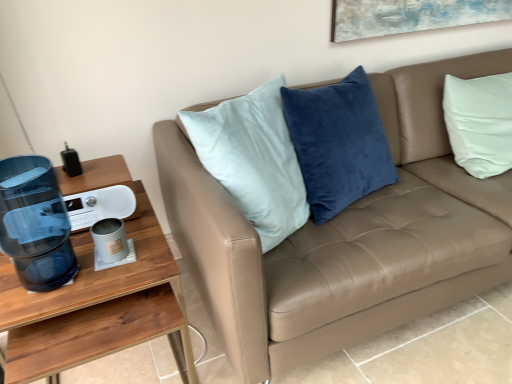
This screenshot has height=384, width=512. In order to click on wooden desk at left in this screenshot , I will do `click(97, 308)`.

Locate an element on the screen. This screenshot has width=512, height=384. matte gray mug at lower left is located at coordinates (110, 240).

Locate an element on the screen. transparent plastic water cooler at left is located at coordinates (35, 223).

Image resolution: width=512 pixels, height=384 pixels. What are the coordinates of `tan leather couch at center` in the screenshot? It's located at (346, 237).

Would you consider tan leather couch at center to be distant from transparent plastic water cooler at left?

Actually, tan leather couch at center and transparent plastic water cooler at left are a little close together.

What are the coordinates of `water cooler behind the tan leather couch at center` in the screenshot? It's located at (35, 223).

Consider the image. How much distance is there between tan leather couch at center and transparent plastic water cooler at left?

tan leather couch at center and transparent plastic water cooler at left are 71.36 centimeters apart.

Is point (470, 71) positioned before point (19, 219)?

No, it is behind (19, 219).

Would you say transparent plastic water cooler at left is inside or outside wooden desk at left?

transparent plastic water cooler at left is not enclosed by wooden desk at left.

Is transparent plastic water cooler at left turned away from wooden desk at left?

No, transparent plastic water cooler at left is not facing away from wooden desk at left.

From a real-world perspective, does transparent plastic water cooler at left sit lower than wooden desk at left?

No, from a real-world perspective, transparent plastic water cooler at left is not under wooden desk at left.

Considering the points (51, 208) and (122, 347), which point is in front, point (51, 208) or point (122, 347)?

The point (122, 347) is closer.

Where is `coffee cup behind the wooden desk at left`? coffee cup behind the wooden desk at left is located at coordinates (110, 240).

From the image's perspective, relative to matte gray mug at lower left, is wooden desk at left above or below?

From the image's perspective, wooden desk at left appears below matte gray mug at lower left.

Which is in front, point (64, 358) or point (124, 253)?

Positioned in front is point (64, 358).

Is matte gray mug at lower left completely or partially inside wooden desk at left?

No.

Is wooden desk at left not within transparent plastic water cooler at left?

Yes, wooden desk at left is outside of transparent plastic water cooler at left.

Which object is positioned more to the left, wooden desk at left or transparent plastic water cooler at left?

transparent plastic water cooler at left is more to the left.

In terms of height, does wooden desk at left look taller or shorter compared to transparent plastic water cooler at left?

wooden desk at left is taller than transparent plastic water cooler at left.

Is wooden desk at left bigger than transparent plastic water cooler at left?

Yes.

Which is in front, matte gray mug at lower left or wooden desk at left?

Positioned in front is wooden desk at left.

Would you say matte gray mug at lower left is a long distance from wooden desk at left?

No, matte gray mug at lower left is in close proximity to wooden desk at left.

Can you confirm if matte gray mug at lower left is thinner than wooden desk at left?

Yes.

From the image's perspective, is tan leather couch at center on wooden desk at left?

Yes, from the image's perspective, tan leather couch at center is on top of wooden desk at left.

Can you confirm if tan leather couch at center is smaller than wooden desk at left?

Incorrect, tan leather couch at center is not smaller in size than wooden desk at left.

Could you tell me if tan leather couch at center is facing wooden desk at left?

No, tan leather couch at center is not turned towards wooden desk at left.

From a real-world perspective, which is physically below, tan leather couch at center or wooden desk at left?

wooden desk at left, from a real-world perspective.

From a real-world perspective, between transparent plastic water cooler at left and tan leather couch at center, who is vertically higher?

In real-world perspective, transparent plastic water cooler at left is above.

Where is `studio couch in front of the transparent plastic water cooler at left`? The image size is (512, 384). studio couch in front of the transparent plastic water cooler at left is located at coordinates (346, 237).

Considering the relative sizes of transparent plastic water cooler at left and tan leather couch at center in the image provided, is transparent plastic water cooler at left thinner than tan leather couch at center?

Indeed, transparent plastic water cooler at left has a lesser width compared to tan leather couch at center.

Does transparent plastic water cooler at left appear on the right side of tan leather couch at center?

In fact, transparent plastic water cooler at left is to the left of tan leather couch at center.

At what (x,y) coordinates should I click in order to perform the action: click on studio couch above the transparent plastic water cooler at left (from the image's perspective). Please return your answer as a coordinate pair (x, y). The height and width of the screenshot is (384, 512). Looking at the image, I should click on (x=346, y=237).

Where is `water cooler that appears behind the wooden desk at left`? water cooler that appears behind the wooden desk at left is located at coordinates (35, 223).

When comparing their distances from tan leather couch at center, does wooden desk at left or transparent plastic water cooler at left seem further?

The object further to tan leather couch at center is transparent plastic water cooler at left.

Which object lies further to the anchor point tan leather couch at center, matte gray mug at lower left or wooden desk at left?

matte gray mug at lower left.

Considering their positions, is tan leather couch at center positioned closer to matte gray mug at lower left than transparent plastic water cooler at left?

transparent plastic water cooler at left is positioned closer to the anchor matte gray mug at lower left.

Considering their positions, is wooden desk at left positioned further to matte gray mug at lower left than tan leather couch at center?

Among the two, tan leather couch at center is located further to matte gray mug at lower left.

Which object lies nearer to the anchor point tan leather couch at center, transparent plastic water cooler at left or wooden desk at left?

wooden desk at left lies closer to tan leather couch at center than the other object.

Considering their positions, is matte gray mug at lower left positioned closer to transparent plastic water cooler at left than tan leather couch at center?

The object closer to transparent plastic water cooler at left is matte gray mug at lower left.

Estimate the real-world distances between objects in this image. Which object is closer to transparent plastic water cooler at left, matte gray mug at lower left or wooden desk at left?

wooden desk at left is closer to transparent plastic water cooler at left.

From the image, which object appears to be nearer to matte gray mug at lower left, transparent plastic water cooler at left or wooden desk at left?

wooden desk at left lies closer to matte gray mug at lower left than the other object.

The height and width of the screenshot is (384, 512). Identify the location of coffee cup between wooden desk at left and tan leather couch at center from left to right. (110, 240).

Image resolution: width=512 pixels, height=384 pixels. I want to click on coffee cup that lies between transparent plastic water cooler at left and wooden desk at left from top to bottom, so click(x=110, y=240).

Image resolution: width=512 pixels, height=384 pixels. I want to click on coffee cup between transparent plastic water cooler at left and tan leather couch at center from left to right, so click(x=110, y=240).

You are a GUI agent. You are given a task and a screenshot of the screen. Output one action in this format:
    pyautogui.click(x=<x>, y=<y>)
    Task: Click on the desk situated between transparent plastic water cooler at left and tan leather couch at center from left to right
    This screenshot has width=512, height=384.
    Given the screenshot: What is the action you would take?
    pyautogui.click(x=97, y=308)